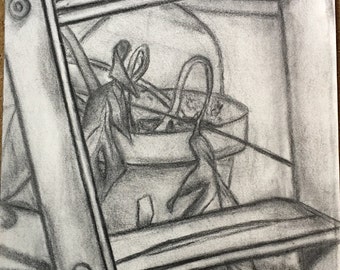
The height and width of the screenshot is (270, 340). What are the coordinates of `flower pot` in the screenshot? It's located at (168, 149).